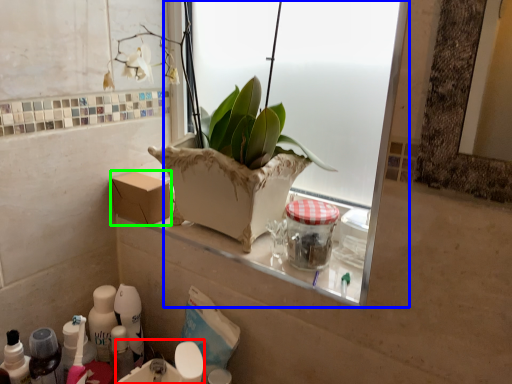
Question: Considering the real-world distances, which object is farthest from sink (highlighted by a red box)? window (highlighted by a blue box) or cardboard box (highlighted by a green box)?

Choices:
 (A) window
 (B) cardboard box

Answer: (A)